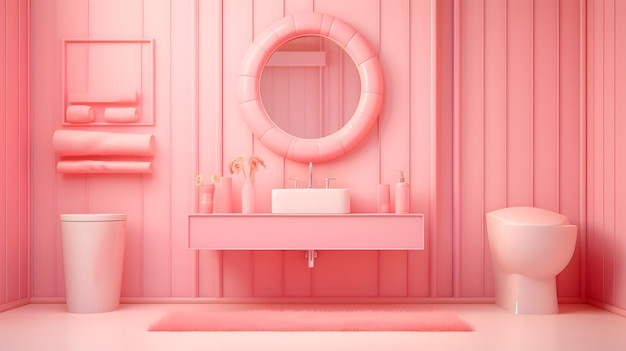
Identify the location of faucet handle. (298, 180), (326, 182).